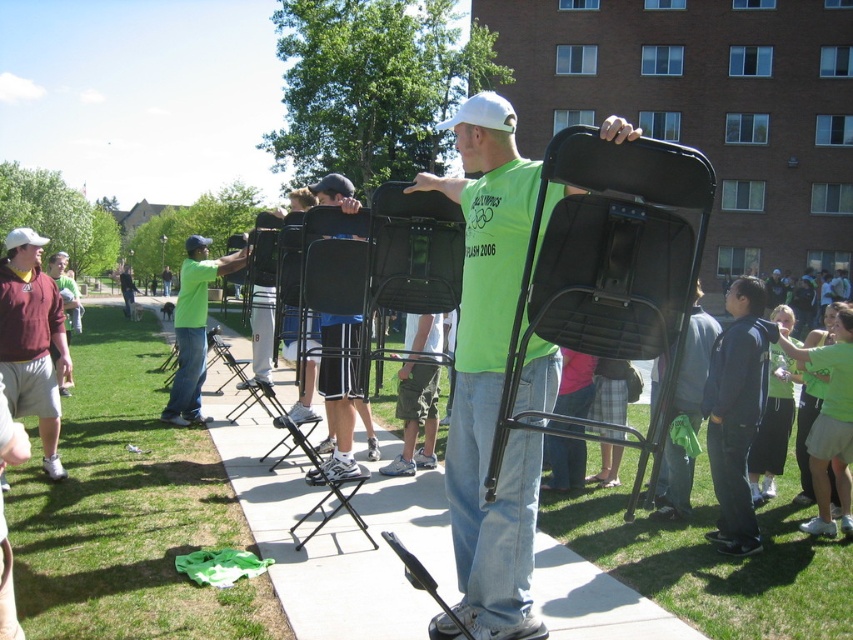
You are a photographer trying to capture a clear photo of both the maroon fabric shirt at left and the green fabric shirt at center. Since you want both subjects to be in focus, which person should you position closer to the camera to ensure both are visible clearly?

The green fabric shirt at center is behind the maroon fabric shirt at left, so you should move the maroon fabric shirt at left closer to the camera to ensure both are in focus.

You are a photographer trying to capture a group photo of the maroon fabric shirt at left and the green fabric shirt at center. Which person should you position to the left in the frame to match their actual positions?

The maroon fabric shirt at left should be positioned to the left in the frame since it is already on the left side of the green fabric shirt at center in the scene.

You are a photographer standing in the park and you see the black plastic chair at center and the maroon fabric shirt at left. Which object is positioned lower in the image?

The black plastic chair at center is positioned lower than the maroon fabric shirt at left in the image.